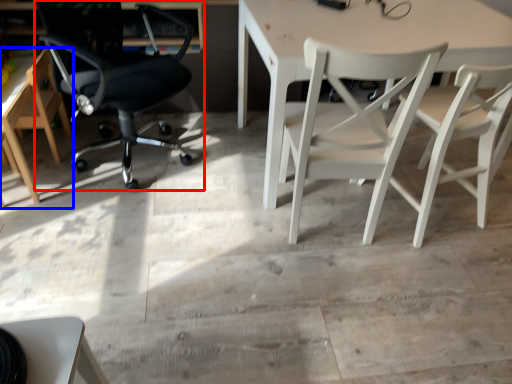
Question: Which object is further to the camera taking this photo, chair (highlighted by a red box) or chair (highlighted by a blue box)?

Choices:
 (A) chair
 (B) chair

Answer: (B)